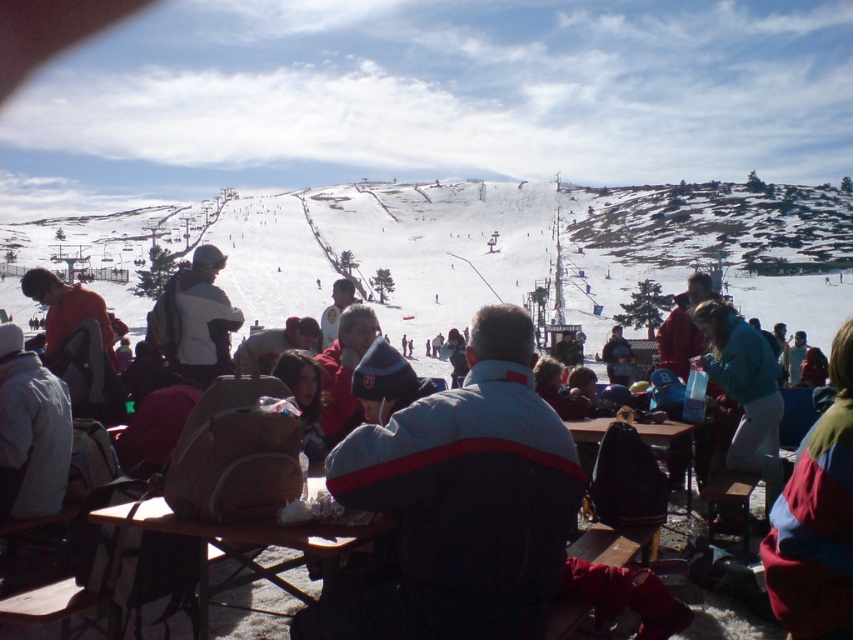
Consider the image. Can you confirm if multicolored fabric jacket at lower right is bigger than white fleece jacket at center?

Correct, multicolored fabric jacket at lower right is larger in size than white fleece jacket at center.

Is multicolored fabric jacket at lower right smaller than white fleece jacket at center?

No, multicolored fabric jacket at lower right is not smaller than white fleece jacket at center.

Find the location of a particular element. This screenshot has width=853, height=640. multicolored fabric jacket at lower right is located at coordinates (816, 518).

Locate an element on the screen. multicolored fabric jacket at lower right is located at coordinates (816, 518).

Who is shorter, brown wooden table at center or matte gray backpack at center?

With less height is brown wooden table at center.

Between point (250, 577) and point (756, 509), which one is positioned behind?

The point (756, 509) is behind.

Is point (294, 593) positioned after point (712, 636)?

No, (294, 593) is closer to viewer.

Find the location of a particular element. The width and height of the screenshot is (853, 640). brown wooden table at center is located at coordinates (247, 545).

Which is in front, point (328, 544) or point (740, 333)?

Point (328, 544) is in front.

The height and width of the screenshot is (640, 853). Describe the element at coordinates (247, 545) in the screenshot. I see `brown wooden table at center` at that location.

The width and height of the screenshot is (853, 640). I want to click on brown wooden table at center, so click(x=247, y=545).